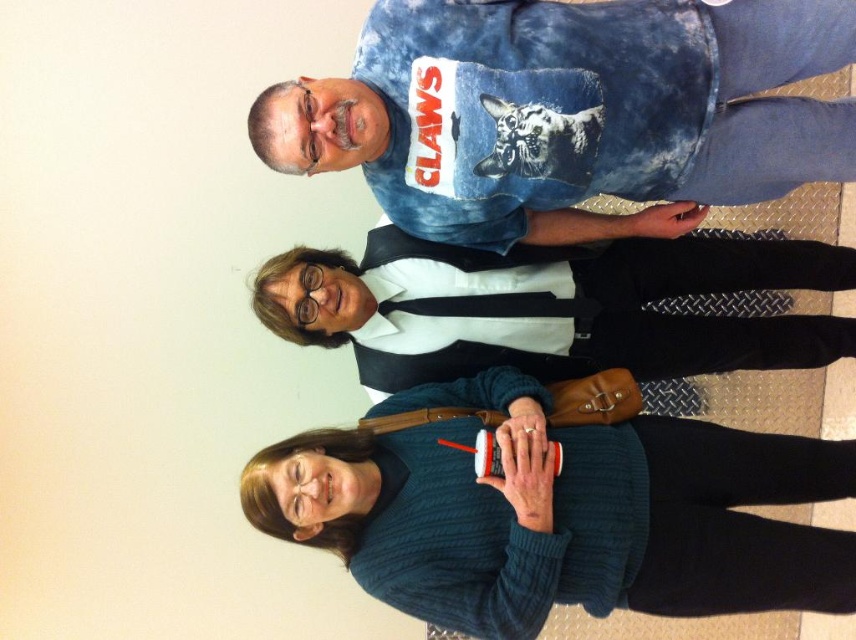
You are standing in the room and see two points marked on the wall. The first point is at coordinate point (x=484, y=60) and the second is at point (x=418, y=260). Which point is closer to you?

Point (x=484, y=60) is in front of point (x=418, y=260), so it is closer to you.

Which object is located at the coordinates point (560, 513)?

The point (560, 513) is located on the dark blue knitted sweater at center.

You are standing at point [595,131] and want to walk to point [742,525]. Considering the positions of the three people in the image, will you have to walk around anyone?

Point [595,131] is in front of point [742,525], so you will have to walk around the person at the top of the image who is leaning forward and the middle person in the white collared shirt and black vest to reach your destination.